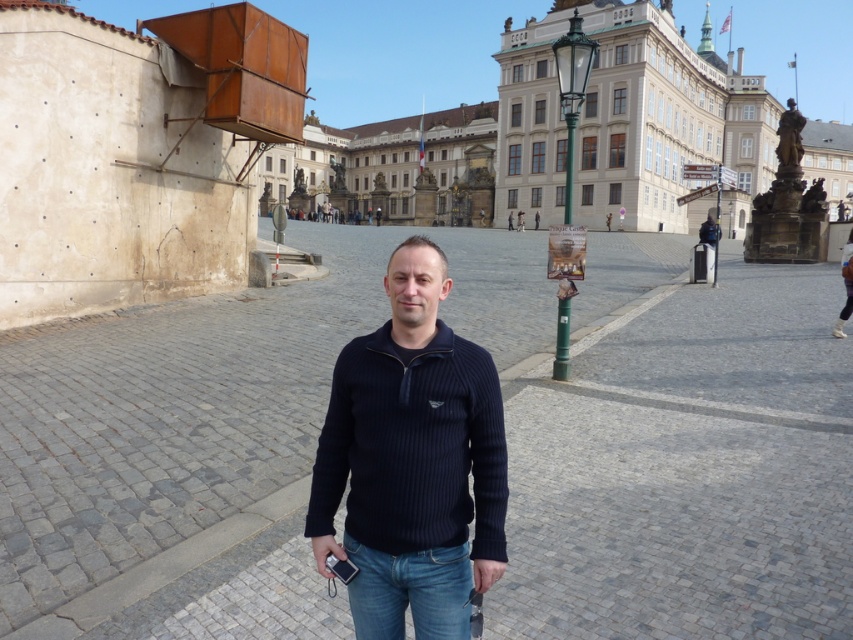
You are a fashion designer observing a person in the plaza. The person is wearing a dark blue ribbed sweater at center and blue denim jeans at center. Which clothing item is positioned more to the right side of the person?

The dark blue ribbed sweater at center is positioned more to the right side of the person than the blue denim jeans at center.

You are a photographer trying to capture a wide shot of the plaza. Your camera has a maximum focus range of 5 meters. Can you clearly capture the dark blue ribbed sweater at center in your photo?

The dark blue ribbed sweater at center is 4.98 meters away from the camera, which is within the 5 meter focus range. Yes, the sweater can be clearly captured.

You are a fashion designer analyzing the image of a person in a plaza. The person is wearing a dark blue ribbed sweater at center. Where on the body is the dark blue ribbed sweater positioned?

The dark blue ribbed sweater at center is positioned on the upper body, as it is described as being worn by the person in the image.